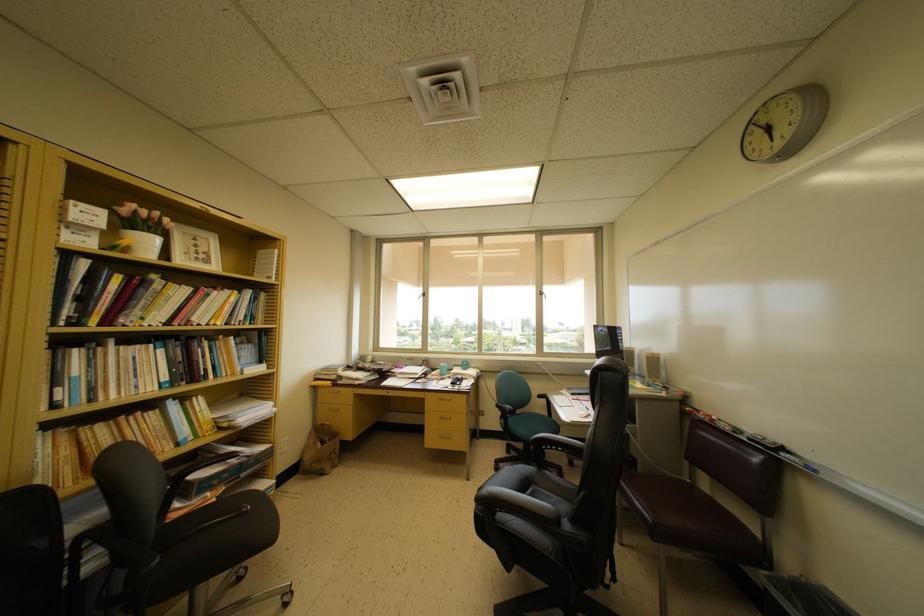
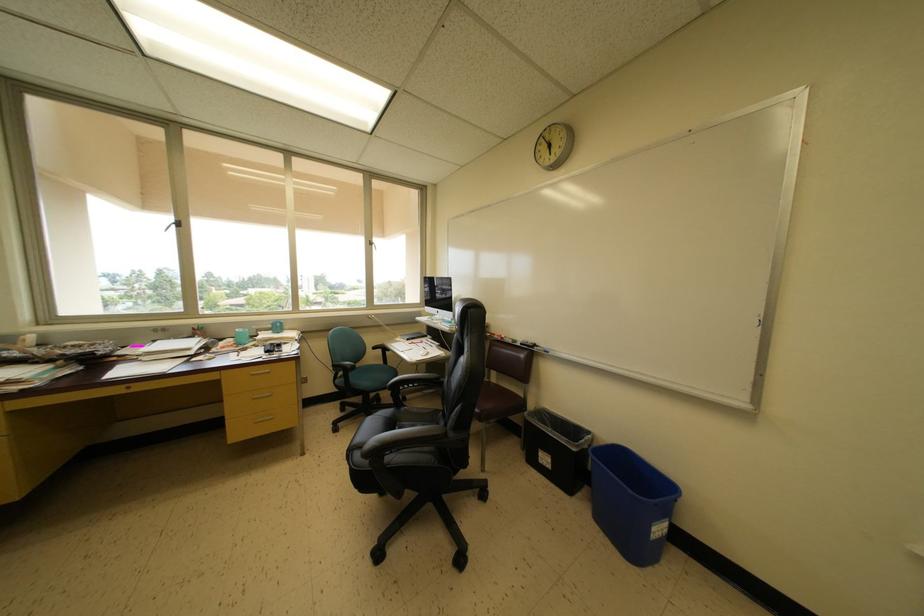
Where in the second image is the point corresponding to point (551, 477) from the first image?

(408, 413)